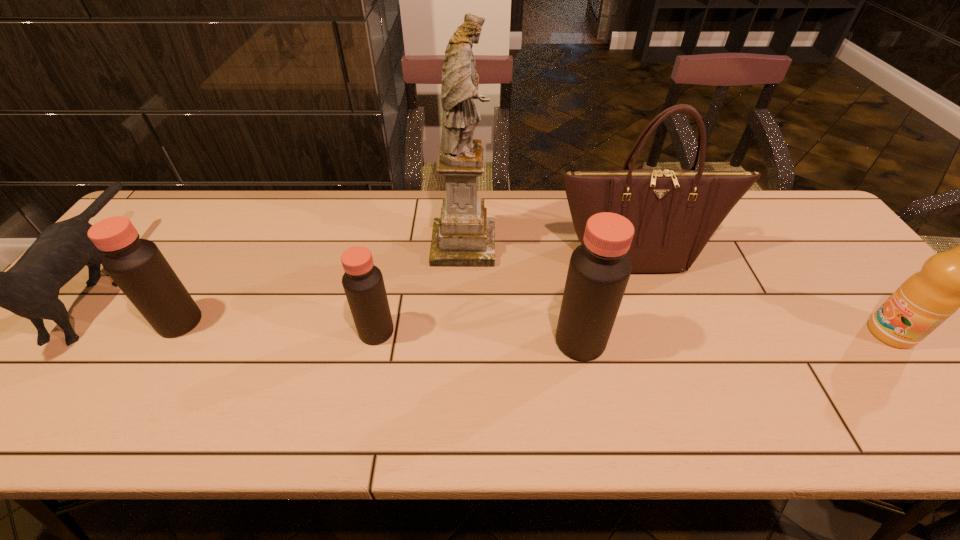
Where is `vacant space located on the back of the sixth object from right to left`? vacant space located on the back of the sixth object from right to left is located at coordinates (216, 262).

Find the location of a particular element. This screenshot has width=960, height=540. free location located on the back of the fifth object from right to left is located at coordinates (396, 233).

In order to click on vacant area situated 0.100m on the back of the rightmost vinegar in this screenshot , I will do `click(570, 292)`.

Find the location of a particular element. This screenshot has width=960, height=540. vacant space positioned on the front-facing side of the sculpture is located at coordinates [x=623, y=245].

Locate an element on the screen. The height and width of the screenshot is (540, 960). vacant area located 0.200m on the front label of the rightmost object is located at coordinates (786, 333).

The image size is (960, 540). I want to click on vacant space situated on the front label of the rightmost object, so click(x=806, y=333).

At what (x,y) coordinates should I click in order to perform the action: click on vacant region located on the front label of the rightmost object. Please return your answer as a coordinate pair (x, y). The image size is (960, 540). Looking at the image, I should click on (703, 333).

Image resolution: width=960 pixels, height=540 pixels. Find the location of `vacant space situated 0.200m on the front-facing side of the second tallest object`. vacant space situated 0.200m on the front-facing side of the second tallest object is located at coordinates (664, 336).

This screenshot has width=960, height=540. Find the location of `sculpture that is positioned at the far edge`. sculpture that is positioned at the far edge is located at coordinates (463, 236).

This screenshot has width=960, height=540. Identify the location of cat that is at the far edge. (30, 289).